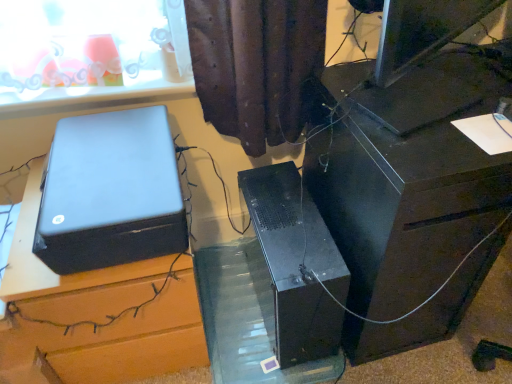
Image resolution: width=512 pixels, height=384 pixels. I want to click on black plastic speaker at upper left, positioned as the 2th furniture in right-to-left order, so click(123, 339).

What is the approximate width of black plastic speaker at upper left, positioned as the 2th furniture in right-to-left order?

It is 19.38 inches.

Identify the location of satin black printer at left. The height and width of the screenshot is (384, 512). (110, 192).

How many degrees apart are the facing directions of satin black printer at left and black plastic speaker at upper left, positioned as the 2th furniture in right-to-left order?

The facing directions of satin black printer at left and black plastic speaker at upper left, positioned as the 2th furniture in right-to-left order, are 0.000407 degrees apart.

Is satin black printer at left positioned beyond the bounds of black plastic speaker at upper left, placed as the 1th furniture when sorted from left to right?

satin black printer at left lies outside black plastic speaker at upper left, placed as the 1th furniture when sorted from left to right,'s area.

Measure the distance from satin black printer at left to black plastic speaker at upper left, positioned as the 2th furniture in right-to-left order.

satin black printer at left is 7.80 inches from black plastic speaker at upper left, positioned as the 2th furniture in right-to-left order.

From the image's perspective, which is below, satin black printer at left or black plastic speaker at upper left, positioned as the 2th furniture in right-to-left order?

black plastic speaker at upper left, positioned as the 2th furniture in right-to-left order.

Image resolution: width=512 pixels, height=384 pixels. Identify the location of box on the left side of black matte computer tower at center. (110, 192).

Is satin black printer at left oriented towards black matte computer tower at center?

No, satin black printer at left is not aimed at black matte computer tower at center.

From the image's perspective, is satin black printer at left located above or below black matte computer tower at center?

Clearly, from the image's perspective, satin black printer at left is above black matte computer tower at center.

Is the surface of black matte computer tower at center in direct contact with satin black printer at left?

No, black matte computer tower at center is not beside satin black printer at left.

Is satin black printer at left at the back of black matte computer tower at center?

No, black matte computer tower at center is not facing the opposite direction of satin black printer at left.

Choose the correct answer: Is black matte computer tower at center inside satin black printer at left or outside it?

black matte computer tower at center exists outside the volume of satin black printer at left.

Considering the sizes of objects black plastic desk at right, positioned as the 1th furniture in right-to-left order, and transparent plastic glass table at center in the image provided, who is smaller, black plastic desk at right, positioned as the 1th furniture in right-to-left order, or transparent plastic glass table at center?

transparent plastic glass table at center.

Is point (309, 95) farther from camera compared to point (220, 342)?

No, (309, 95) is closer to viewer.

This screenshot has width=512, height=384. I want to click on glass table that appears below the black plastic desk at right, positioned as the 1th furniture in right-to-left order (from the image's perspective), so click(246, 318).

Consider the image. Which of these two, satin black printer at left or transparent plastic glass table at center, is thinner?

satin black printer at left is thinner.

Locate an element on the screen. The height and width of the screenshot is (384, 512). glass table located behind the satin black printer at left is located at coordinates (246, 318).

Is point (155, 252) closer to camera compared to point (206, 271)?

That is True.

In terms of size, does satin black printer at left appear bigger or smaller than transparent plastic glass table at center?

Considering their sizes, satin black printer at left takes up more space than transparent plastic glass table at center.

From the image's perspective, is black plastic desk at right, which is counted as the second furniture, starting from the left, positioned above or below black plastic speaker at upper left, placed as the 1th furniture when sorted from left to right?

black plastic desk at right, which is counted as the second furniture, starting from the left, is situated higher than black plastic speaker at upper left, placed as the 1th furniture when sorted from left to right, in the image.

Identify the location of furniture located on the left of black plastic desk at right, which is counted as the second furniture, starting from the left. The width and height of the screenshot is (512, 384). (123, 339).

Which object is further away from the camera, black plastic desk at right, positioned as the 1th furniture in right-to-left order, or black plastic speaker at upper left, positioned as the 2th furniture in right-to-left order?

black plastic speaker at upper left, positioned as the 2th furniture in right-to-left order, is further from the camera.

Is black plastic desk at right, which is counted as the second furniture, starting from the left, directly adjacent to black plastic speaker at upper left, positioned as the 2th furniture in right-to-left order?

black plastic desk at right, which is counted as the second furniture, starting from the left, is not next to black plastic speaker at upper left, positioned as the 2th furniture in right-to-left order, and they're not touching.

Could you tell me if transparent plastic glass table at center is turned towards satin black printer at left?

No, transparent plastic glass table at center is not turned towards satin black printer at left.

Considering the relative positions of transparent plastic glass table at center and satin black printer at left in the image provided, is transparent plastic glass table at center to the right of satin black printer at left from the viewer's perspective?

Yes.

Based on the photo, considering the relative sizes of transparent plastic glass table at center and satin black printer at left in the image provided, is transparent plastic glass table at center smaller than satin black printer at left?

Yes.

Locate an element on the screen. furniture that is on the left side of satin black printer at left is located at coordinates (123, 339).

In the image, there is a satin black printer at left. In order to click on computer tower below it (from a real-world perspective) in this screenshot , I will do `click(297, 263)`.

When comparing their distances from black plastic speaker at upper left, placed as the 1th furniture when sorted from left to right, does transparent plastic glass table at center or black plastic desk at right, positioned as the 1th furniture in right-to-left order, seem closer?

transparent plastic glass table at center.

From the image, which object appears to be nearer to transparent plastic glass table at center, black matte computer tower at center or black plastic speaker at upper left, placed as the 1th furniture when sorted from left to right?

black matte computer tower at center is positioned closer to the anchor transparent plastic glass table at center.

Estimate the real-world distances between objects in this image. Which object is closer to satin black printer at left, black plastic speaker at upper left, positioned as the 2th furniture in right-to-left order, or transparent plastic glass table at center?

Based on the image, black plastic speaker at upper left, positioned as the 2th furniture in right-to-left order, appears to be nearer to satin black printer at left.

When comparing their distances from black matte computer tower at center, does satin black printer at left or black plastic desk at right, which is counted as the second furniture, starting from the left, seem closer?

black plastic desk at right, which is counted as the second furniture, starting from the left.

Based on their spatial positions, is satin black printer at left or black matte computer tower at center closer to black plastic desk at right, which is counted as the second furniture, starting from the left?

Based on the image, black matte computer tower at center appears to be nearer to black plastic desk at right, which is counted as the second furniture, starting from the left.

When comparing their distances from black plastic desk at right, positioned as the 1th furniture in right-to-left order, does transparent plastic glass table at center or black plastic speaker at upper left, placed as the 1th furniture when sorted from left to right, seem further?

black plastic speaker at upper left, placed as the 1th furniture when sorted from left to right, is positioned further to the anchor black plastic desk at right, positioned as the 1th furniture in right-to-left order.

From the image, which object appears to be farther from satin black printer at left, transparent plastic glass table at center or black matte computer tower at center?

Among the two, transparent plastic glass table at center is located further to satin black printer at left.

Considering their positions, is black plastic speaker at upper left, positioned as the 2th furniture in right-to-left order, positioned closer to black matte computer tower at center than black plastic desk at right, positioned as the 1th furniture in right-to-left order?

black plastic desk at right, positioned as the 1th furniture in right-to-left order.

Find the location of a particular element. This screenshot has height=384, width=512. computer tower between black plastic speaker at upper left, placed as the 1th furniture when sorted from left to right, and black plastic desk at right, positioned as the 1th furniture in right-to-left order, from left to right is located at coordinates (297, 263).

This screenshot has width=512, height=384. I want to click on box situated between black plastic speaker at upper left, positioned as the 2th furniture in right-to-left order, and black matte computer tower at center from left to right, so click(110, 192).

The height and width of the screenshot is (384, 512). I want to click on glass table between black plastic speaker at upper left, placed as the 1th furniture when sorted from left to right, and black plastic desk at right, positioned as the 1th furniture in right-to-left order, in the horizontal direction, so click(x=246, y=318).

Locate an element on the screen. This screenshot has width=512, height=384. computer tower between transparent plastic glass table at center and black plastic desk at right, positioned as the 1th furniture in right-to-left order, in the horizontal direction is located at coordinates (297, 263).